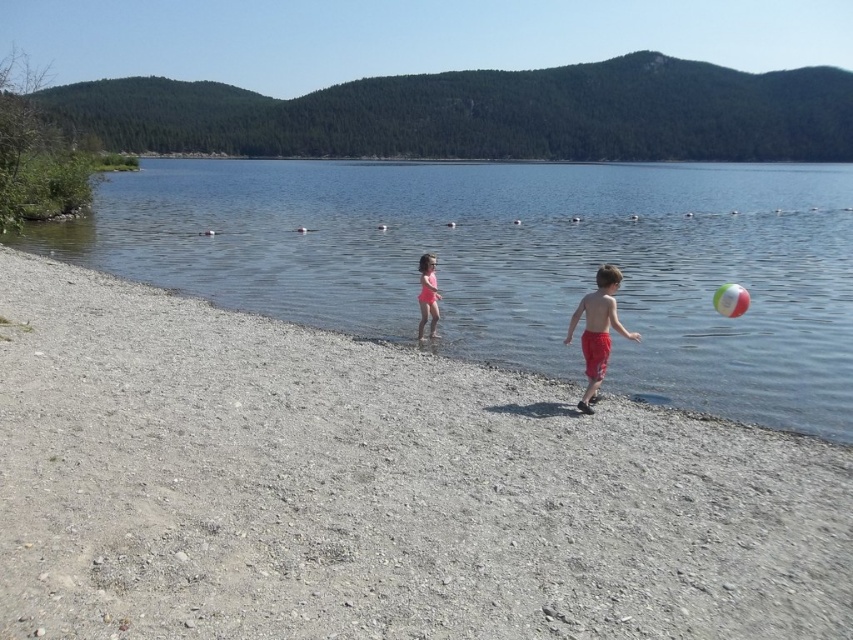
Does gray gravelly sand at center appear over clear water at center?

No.

Looking at this image, does gray gravelly sand at center have a lesser height compared to clear water at center?

Yes, gray gravelly sand at center is shorter than clear water at center.

Which is behind, point (56, 378) or point (297, 296)?

The point (297, 296) is behind.

Where is `gray gravelly sand at center`? The image size is (853, 640). gray gravelly sand at center is located at coordinates point(375,490).

Between clear water at center and pink matte swimsuit at center, which one is positioned higher?

clear water at center is higher up.

Looking at this image, between clear water at center and pink matte swimsuit at center, which one appears on the right side from the viewer's perspective?

From the viewer's perspective, pink matte swimsuit at center appears more on the right side.

Which is in front, point (682, 195) or point (434, 321)?

Point (434, 321)

You are a GUI agent. You are given a task and a screenshot of the screen. Output one action in this format:
    pyautogui.click(x=<x>, y=<y>)
    Task: Click on the clear water at center
    The image size is (853, 640).
    Given the screenshot: What is the action you would take?
    pyautogui.click(x=517, y=262)

Which is below, pink matte swimsuit at center or multicolored rubber ball at right?

pink matte swimsuit at center

Can you confirm if pink matte swimsuit at center is smaller than multicolored rubber ball at right?

Yes, pink matte swimsuit at center is smaller than multicolored rubber ball at right.

Does point (422, 282) come farther from viewer compared to point (735, 292)?

Yes, point (422, 282) is farther from viewer.

The height and width of the screenshot is (640, 853). I want to click on pink matte swimsuit at center, so click(427, 294).